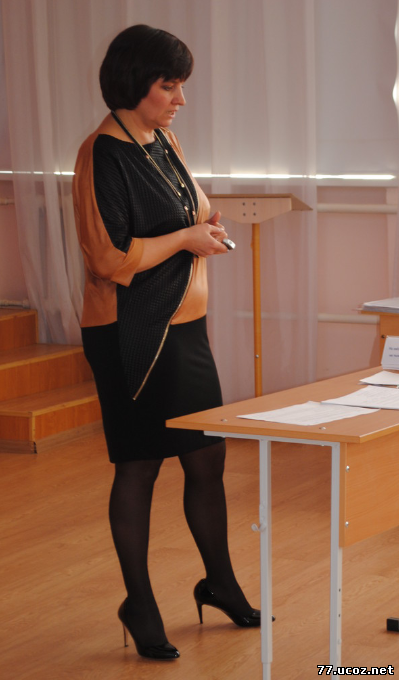
Where is `podium`? The width and height of the screenshot is (399, 680). podium is located at coordinates (252, 209).